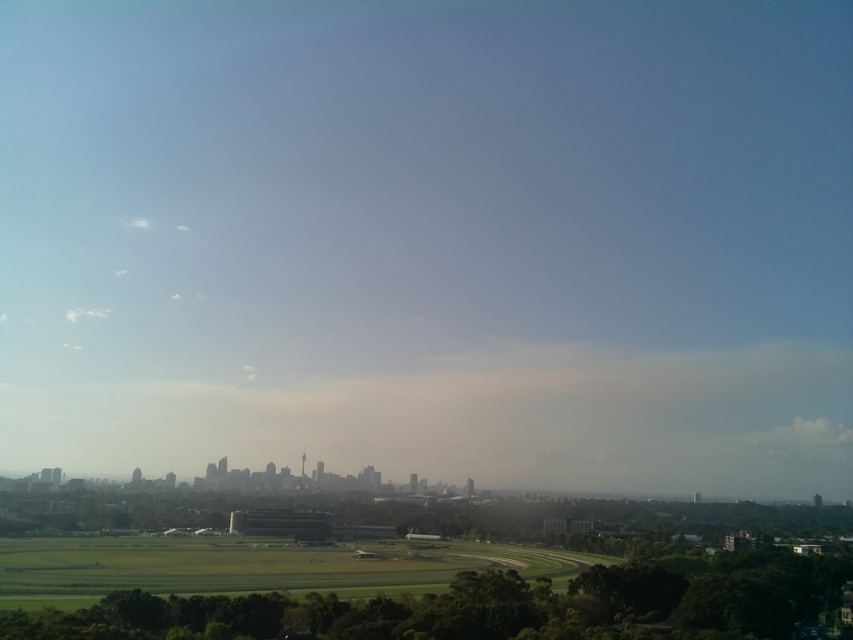
Question: From the image, what is the correct spatial relationship of green grass at center in relation to white fluffy cloud at upper left?

Choices:
 (A) left
 (B) right

Answer: (B)

Question: Does green grass at center come in front of white fluffy cloud at upper left?

Choices:
 (A) yes
 (B) no

Answer: (A)

Question: Which point is farther to the camera?

Choices:
 (A) (88, 316)
 (B) (28, 563)

Answer: (A)

Question: Which of the following is the closest to the observer?

Choices:
 (A) white fluffy cloud at upper left
 (B) green grass at center

Answer: (B)

Question: Is green grass at center smaller than white fluffy cloud at upper left?

Choices:
 (A) yes
 (B) no

Answer: (B)